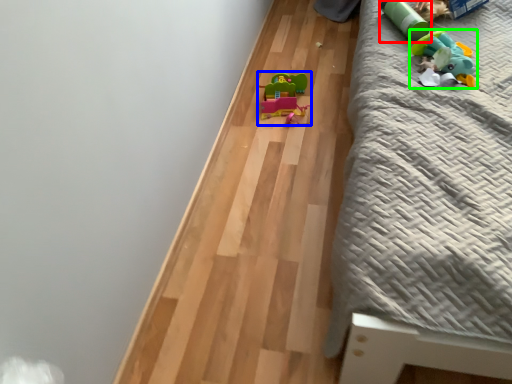
Question: Estimate the real-world distances between objects in this image. Which object is closer to toy (highlighted by a red box), toy (highlighted by a blue box) or toy (highlighted by a green box)?

Choices:
 (A) toy
 (B) toy

Answer: (B)